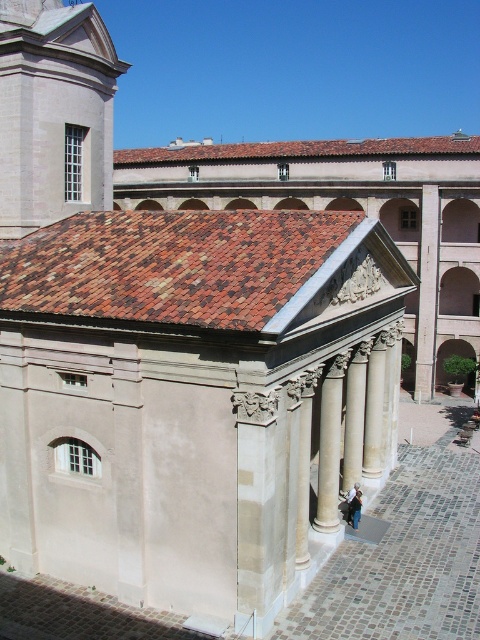
Based on the photo, which is below, smooth stone tower at upper left or white marble pillar at center?

white marble pillar at center

Does smooth stone tower at upper left lie in front of white marble pillar at center?

No, it is behind white marble pillar at center.

Does point (37, 60) come in front of point (343, 461)?

Yes, it is in front of point (343, 461).

Identify the location of smooth stone tower at upper left. The image size is (480, 640). (54, 113).

Who is shorter, smooth stone column at right or white marble column at center?

white marble column at center

Which of these two, smooth stone column at right or white marble column at center, stands taller?

smooth stone column at right is taller.

This screenshot has height=640, width=480. What do you see at coordinates (428, 292) in the screenshot? I see `smooth stone column at right` at bounding box center [428, 292].

Image resolution: width=480 pixels, height=640 pixels. Find the location of `smooth stone column at right`. smooth stone column at right is located at coordinates (428, 292).

Which of these two, smooth stone tower at upper left or smooth stone column at right, stands taller?

With more height is smooth stone column at right.

Does smooth stone tower at upper left have a larger size compared to smooth stone column at right?

No, smooth stone tower at upper left is not bigger than smooth stone column at right.

Who is more distant from viewer, [0,221] or [420,385]?

Positioned behind is point [420,385].

Identify the location of smooth stone tower at upper left. (54, 113).